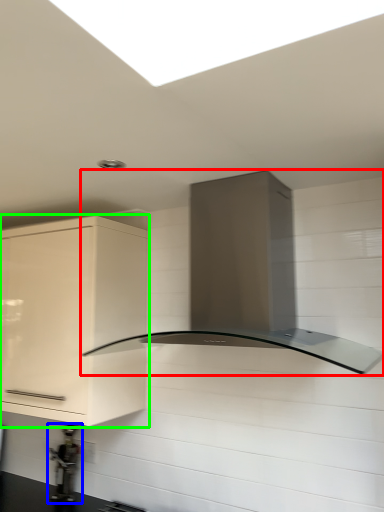
Question: Estimate the real-world distances between objects in this image. Which object is farther from home appliance (highlighted by a red box), appliance (highlighted by a blue box) or cabinetry (highlighted by a green box)?

Choices:
 (A) appliance
 (B) cabinetry

Answer: (A)